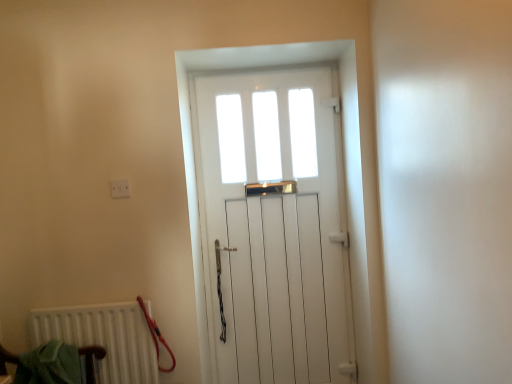
The image size is (512, 384). In order to click on white plastic electric outlet at upper left in this screenshot , I will do coord(120,188).

Identify the location of green fabric armchair at lower left. The height and width of the screenshot is (384, 512). (91, 359).

You are a GUI agent. You are given a task and a screenshot of the screen. Output one action in this format:
    pyautogui.click(x=<x>, y=<y>)
    Task: Click on the radiator that is under the white plastic electric outlet at upper left (from a real-world perspective)
    This screenshot has height=384, width=512.
    Given the screenshot: What is the action you would take?
    pyautogui.click(x=103, y=338)

From a real-world perspective, is white matte radiator at lower left physically located above or below white plastic electric outlet at upper left?

Clearly, from a real-world perspective, white matte radiator at lower left is below white plastic electric outlet at upper left.

Is point (63, 319) closer or farther from the camera than point (125, 183)?

Point (63, 319) is positioned closer to the camera compared to point (125, 183).

Considering the sizes of objects white matte radiator at lower left and white plastic electric outlet at upper left in the image provided, who is shorter, white matte radiator at lower left or white plastic electric outlet at upper left?

Standing shorter between the two is white plastic electric outlet at upper left.

Is white matte radiator at lower left closer to camera compared to white wooden door at center?

Yes, the depth of white matte radiator at lower left is less than that of white wooden door at center.

In the scene shown: How different are the orientations of white matte radiator at lower left and white wooden door at center in degrees?

The facing directions of white matte radiator at lower left and white wooden door at center are 0.667 degrees apart.

In terms of size, does white matte radiator at lower left appear bigger or smaller than white wooden door at center?

Clearly, white matte radiator at lower left is smaller in size than white wooden door at center.

Is green fabric armchair at lower left looking in the opposite direction of white matte radiator at lower left?

green fabric armchair at lower left does not have its back to white matte radiator at lower left.

Find the location of `armchair that is under the white matte radiator at lower left (from a real-world perspective)`. armchair that is under the white matte radiator at lower left (from a real-world perspective) is located at coordinates (91, 359).

From the picture: Can you see green fabric armchair at lower left touching white matte radiator at lower left?

No, green fabric armchair at lower left is not next to white matte radiator at lower left.

Can you confirm if green fabric armchair at lower left is wider than white matte radiator at lower left?

Yes, green fabric armchair at lower left is wider than white matte radiator at lower left.

Which object is thinner, white matte radiator at lower left or green fabric armchair at lower left?

white matte radiator at lower left is thinner.

Is white matte radiator at lower left facing away from green fabric armchair at lower left?

Yes, green fabric armchair at lower left is at the back of white matte radiator at lower left.

Can you tell me how much white matte radiator at lower left and green fabric armchair at lower left differ in facing direction?

The facing directions of white matte radiator at lower left and green fabric armchair at lower left are 89.1 degrees apart.

Who is smaller, white matte radiator at lower left or green fabric armchair at lower left?

Smaller between the two is white matte radiator at lower left.

From a real-world perspective, who is located higher, white plastic electric outlet at upper left or green fabric armchair at lower left?

From a 3D spatial view, white plastic electric outlet at upper left is above.

Between white plastic electric outlet at upper left and green fabric armchair at lower left, which one has smaller size?

white plastic electric outlet at upper left is smaller.

From the image's perspective, which one is positioned higher, white plastic electric outlet at upper left or green fabric armchair at lower left?

From the image's view, white plastic electric outlet at upper left is above.

Which of these two, white wooden door at center or white plastic electric outlet at upper left, is bigger?

white wooden door at center is bigger.

Find the location of a particular element. door that is on the right side of white plastic electric outlet at upper left is located at coordinates [x=253, y=242].

Which is in front, point (320, 318) or point (125, 183)?

The point (125, 183) is in front.

Is white wooden door at center far away from white plastic electric outlet at upper left?

Actually, white wooden door at center and white plastic electric outlet at upper left are a little close together.

Is green fabric armchair at lower left turned away from white wooden door at center?

No, green fabric armchair at lower left's orientation is not away from white wooden door at center.

Considering the relative positions of green fabric armchair at lower left and white wooden door at center in the image provided, is green fabric armchair at lower left to the left or to the right of white wooden door at center?

In the image, green fabric armchair at lower left appears on the left side of white wooden door at center.

In the scene shown: From a real-world perspective, is green fabric armchair at lower left physically above white wooden door at center?

Incorrect, from a real-world perspective, green fabric armchair at lower left is lower than white wooden door at center.

The width and height of the screenshot is (512, 384). In order to click on electric outlet positioned vertically above the white matte radiator at lower left (from a real-world perspective) in this screenshot , I will do `click(120, 188)`.

This screenshot has height=384, width=512. I want to click on radiator that appears in front of the white wooden door at center, so point(103,338).

Which object lies further to the anchor point white matte radiator at lower left, green fabric armchair at lower left or white plastic electric outlet at upper left?

The object further to white matte radiator at lower left is white plastic electric outlet at upper left.

Estimate the real-world distances between objects in this image. Which object is further from white matte radiator at lower left, white wooden door at center or green fabric armchair at lower left?

white wooden door at center is further to white matte radiator at lower left.

Considering their positions, is white plastic electric outlet at upper left positioned closer to white wooden door at center than green fabric armchair at lower left?

The object closer to white wooden door at center is white plastic electric outlet at upper left.

From the image, which object appears to be nearer to green fabric armchair at lower left, white matte radiator at lower left or white wooden door at center?

Based on the image, white matte radiator at lower left appears to be nearer to green fabric armchair at lower left.

Estimate the real-world distances between objects in this image. Which object is closer to green fabric armchair at lower left, white matte radiator at lower left or white plastic electric outlet at upper left?

white matte radiator at lower left is closer to green fabric armchair at lower left.

From the image, which object appears to be farther from white wooden door at center, green fabric armchair at lower left or white plastic electric outlet at upper left?

Among the two, green fabric armchair at lower left is located further to white wooden door at center.

Which object lies further to the anchor point white matte radiator at lower left, white plastic electric outlet at upper left or green fabric armchair at lower left?

white plastic electric outlet at upper left lies further to white matte radiator at lower left than the other object.

Which object lies further to the anchor point white matte radiator at lower left, white wooden door at center or white plastic electric outlet at upper left?

white wooden door at center is further to white matte radiator at lower left.

Locate an element on the screen. This screenshot has width=512, height=384. radiator between white plastic electric outlet at upper left and green fabric armchair at lower left in the up-down direction is located at coordinates (103, 338).

Locate an element on the screen. electric outlet between white matte radiator at lower left and white wooden door at center from left to right is located at coordinates (120, 188).

Where is `electric outlet between green fabric armchair at lower left and white wooden door at center in the horizontal direction`? electric outlet between green fabric armchair at lower left and white wooden door at center in the horizontal direction is located at coordinates (120, 188).

The image size is (512, 384). In order to click on radiator between green fabric armchair at lower left and white wooden door at center in this screenshot , I will do coord(103,338).